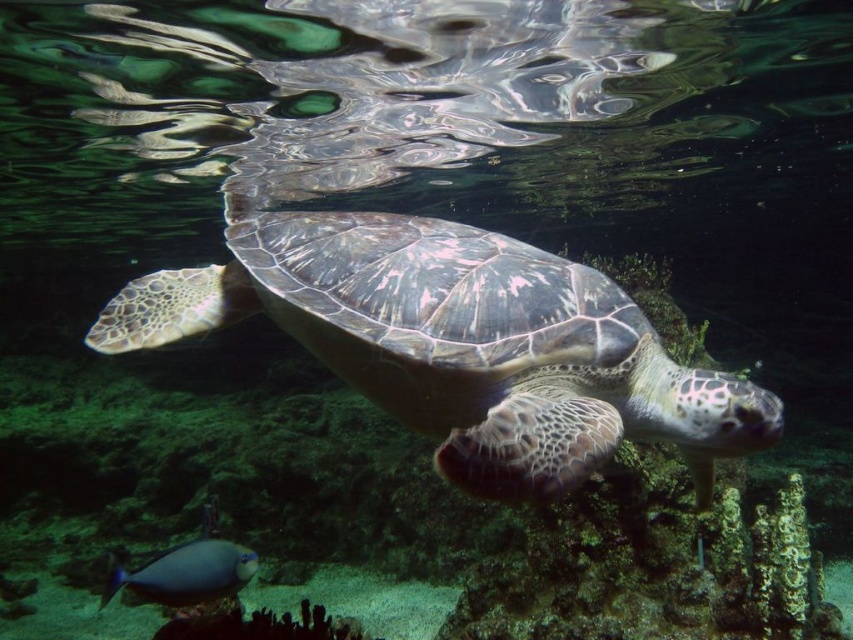
You are a marine biologist observing the underwater scene. You need to determine which object is wider between the leathery green turtle at center and the shiny blue fish at lower left. Based on the scene, can you compare their widths?

The leathery green turtle at center might be wider than shiny blue fish at lower left according to the description.

You are a scuba diver who wants to place a marker between the two points, point (149, 294) and point (238, 570). Which point is closer to you so you can start placing the marker there first?

Point (149, 294) is closer to the viewer than point (238, 570), so you should start placing the marker there first.